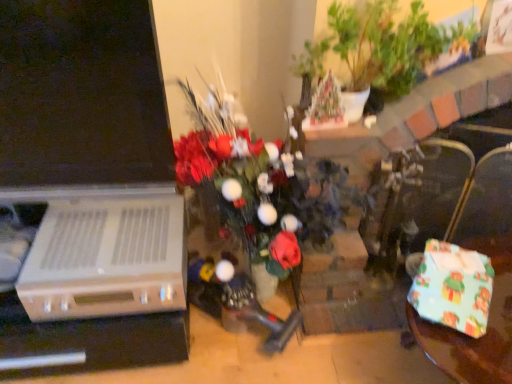
Question: Do you think green leafy plant at upper center is within dark brown leather armchair at right, or outside of it?

Choices:
 (A) inside
 (B) outside

Answer: (B)

Question: Is green leafy plant at upper center in front of or behind dark brown leather armchair at right in the image?

Choices:
 (A) behind
 (B) front

Answer: (B)

Question: Based on their relative distances, which object is farther from the dark brown leather armchair at right?

Choices:
 (A) wrapping paper gift at lower right
 (B) green leafy plant at upper center

Answer: (B)

Question: Estimate the real-world distances between objects in this image. Which object is closer to the wrapping paper gift at lower right?

Choices:
 (A) green leafy plant at upper center
 (B) dark brown leather armchair at right

Answer: (B)